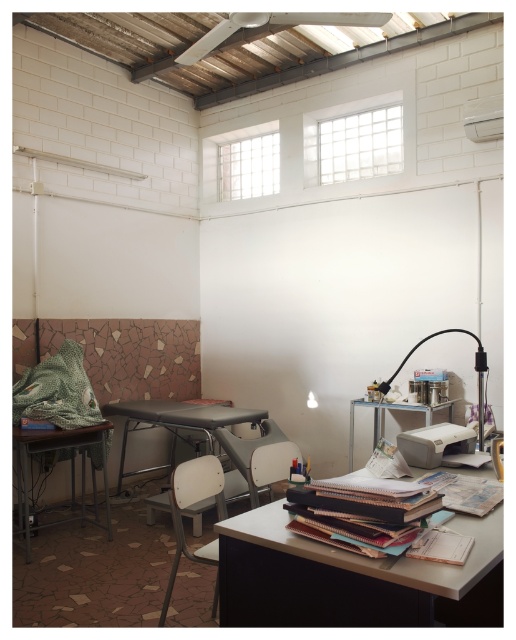
Can you confirm if metallic gray table at center is bigger than white plastic chair at lower center?

Yes.

How far apart are metallic gray table at center and white plastic chair at lower center?

A distance of 4.46 feet exists between metallic gray table at center and white plastic chair at lower center.

Is point (228, 492) less distant than point (187, 474)?

No, it is behind (187, 474).

At what (x,y) coordinates should I click in order to perform the action: click on metallic gray table at center. Please return your answer as a coordinate pair (x, y). This screenshot has width=516, height=640. Looking at the image, I should click on (182, 422).

Does point (394, 579) lie behind point (29, 544)?

That is False.

Describe the element at coordinates (352, 579) in the screenshot. I see `matte brown desk at lower right` at that location.

Identify the location of matte brown desk at lower right. This screenshot has height=640, width=516. (x=352, y=579).

Who is shorter, white grid window at upper center or metallic gray table at lower left?

white grid window at upper center

Is point (383, 161) behind point (30, 488)?

That is True.

Which is in front, point (384, 116) or point (34, 435)?

Point (34, 435) is more forward.

Image resolution: width=516 pixels, height=640 pixels. Find the location of `white grid window at upper center`. white grid window at upper center is located at coordinates (353, 140).